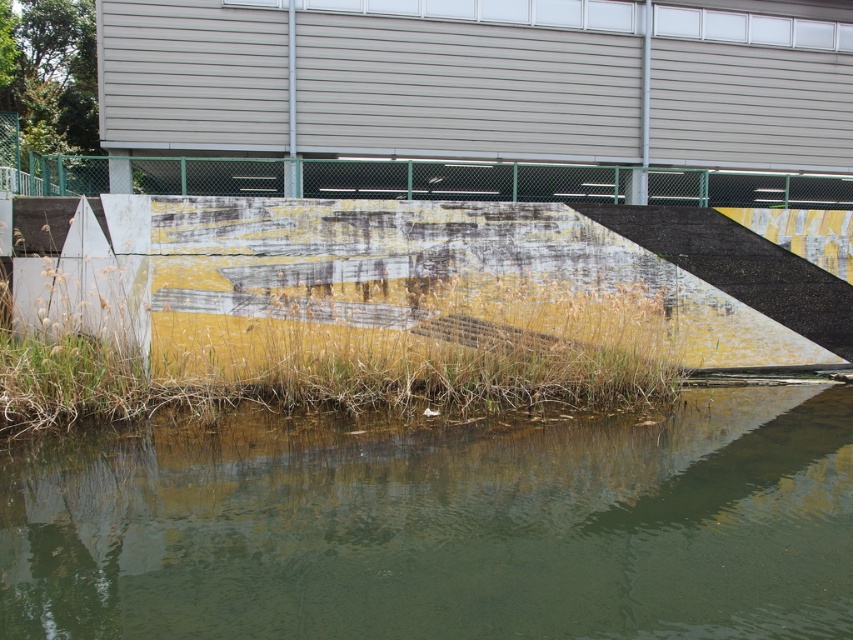
Question: Can you confirm if green matte water at lower center is positioned to the left of green chain-link fence at upper center?

Choices:
 (A) yes
 (B) no

Answer: (B)

Question: Can you confirm if green matte water at lower center is positioned above green chain-link fence at upper center?

Choices:
 (A) no
 (B) yes

Answer: (A)

Question: Is green matte water at lower center above green chain-link fence at upper center?

Choices:
 (A) no
 (B) yes

Answer: (A)